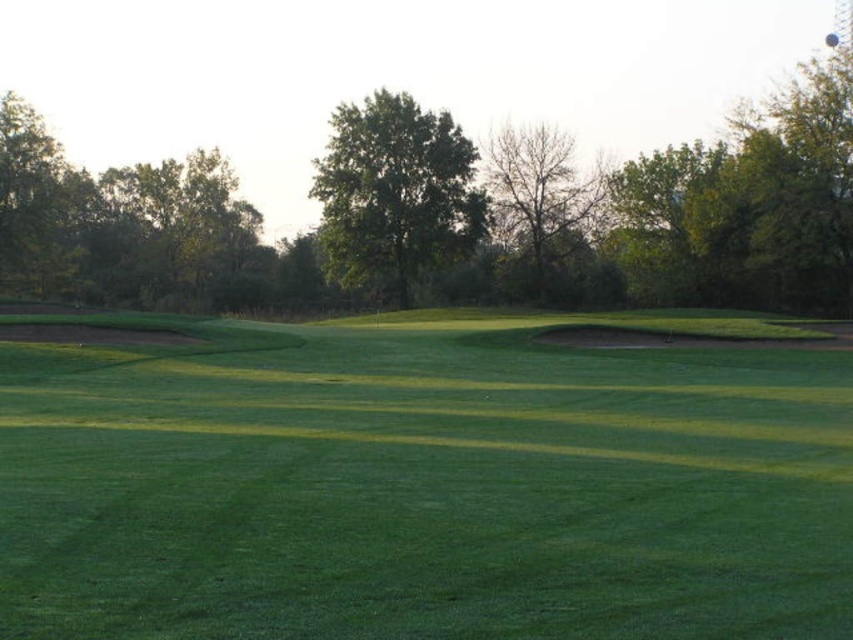
Does green leafy tree at center have a larger size compared to bare branches at center?

Yes, green leafy tree at center is bigger than bare branches at center.

Does point (444, 156) lie behind point (535, 205)?

No, it is in front of (535, 205).

At what (x,y) coordinates should I click in order to perform the action: click on green leafy tree at center. Please return your answer as a coordinate pair (x, y). This screenshot has width=853, height=640. Looking at the image, I should click on (393, 192).

This screenshot has height=640, width=853. I want to click on green leafy tree at upper center, so click(453, 216).

Can you confirm if green leafy tree at upper center is positioned below green leafy tree at center?

Incorrect, green leafy tree at upper center is not positioned below green leafy tree at center.

The width and height of the screenshot is (853, 640). What do you see at coordinates (453, 216) in the screenshot? I see `green leafy tree at upper center` at bounding box center [453, 216].

In order to click on green leafy tree at upper center in this screenshot , I will do `click(453, 216)`.

In the scene shown: Who is positioned more to the right, green grassy field at center or green leafy tree at center?

Positioned to the right is green grassy field at center.

Is green grassy field at center behind green leafy tree at center?

No, it is not.

Measure the distance between green grassy field at center and camera.

green grassy field at center is 21.29 feet away from camera.

Locate an element on the screen. This screenshot has width=853, height=640. green grassy field at center is located at coordinates (422, 484).